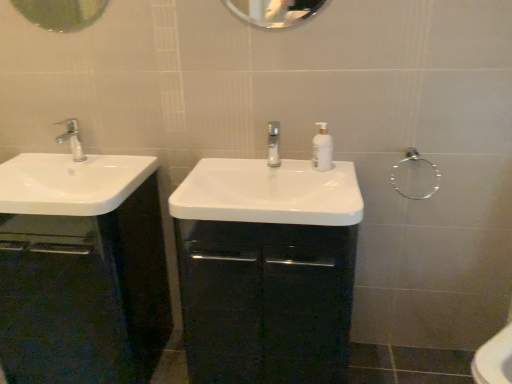
Locate an element on the screen. metallic circular mirror at upper left, which is the second mirror from right to left is located at coordinates (61, 13).

What do you see at coordinates (72, 139) in the screenshot? I see `silver metallic faucet at left, the second tap when ordered from right to left` at bounding box center [72, 139].

The image size is (512, 384). What do you see at coordinates (70, 180) in the screenshot?
I see `white glossy sink at left, the second sink in the right-to-left sequence` at bounding box center [70, 180].

Measure the distance between clear glass towel ring at upper right and camera.

clear glass towel ring at upper right and camera are 5.14 feet apart from each other.

Identify the location of metallic circular mirror at upper left, which is counted as the 1th mirror, starting from the left. This screenshot has width=512, height=384. (61, 13).

Considering the positions of objects glossy black cabinet at center, which is the 2th bathroom cabinet in left-to-right order, and clear glass mirror at upper center, the second mirror viewed from the left, in the image provided, who is more to the left, glossy black cabinet at center, which is the 2th bathroom cabinet in left-to-right order, or clear glass mirror at upper center, the second mirror viewed from the left,?

From the viewer's perspective, glossy black cabinet at center, which is the 2th bathroom cabinet in left-to-right order, appears more on the left side.

Between glossy black cabinet at center, arranged as the 1th bathroom cabinet when viewed from the right, and clear glass mirror at upper center, the first mirror when ordered from right to left, which one has larger size?

glossy black cabinet at center, arranged as the 1th bathroom cabinet when viewed from the right.

From a real-world perspective, is glossy black cabinet at center, arranged as the 1th bathroom cabinet when viewed from the right, located higher than clear glass mirror at upper center, the first mirror when ordered from right to left?

Incorrect, from a real-world perspective, glossy black cabinet at center, arranged as the 1th bathroom cabinet when viewed from the right, is lower than clear glass mirror at upper center, the first mirror when ordered from right to left.

In terms of size, does clear glass tap at center, the 1th tap from the right, appear bigger or smaller than white glossy soap dispenser at center?

Considering their sizes, clear glass tap at center, the 1th tap from the right, takes up more space than white glossy soap dispenser at center.

From a real-world perspective, relative to white glossy soap dispenser at center, is clear glass tap at center, the 2th tap positioned from the left, vertically above or below?

Clearly, from a real-world perspective, clear glass tap at center, the 2th tap positioned from the left, is below white glossy soap dispenser at center.

Where is `tap lying below the white glossy soap dispenser at center (from the image's perspective)`? This screenshot has width=512, height=384. tap lying below the white glossy soap dispenser at center (from the image's perspective) is located at coordinates (273, 144).

Is clear glass towel ring at upper right completely or partially outside of silver metallic faucet at left, the second tap when ordered from right to left?

Yes.

How many degrees apart are the facing directions of clear glass towel ring at upper right and silver metallic faucet at left, the second tap when ordered from right to left?

The angular difference between clear glass towel ring at upper right and silver metallic faucet at left, the second tap when ordered from right to left, is 0.339 degrees.

Is clear glass towel ring at upper right turned away from silver metallic faucet at left, the second tap when ordered from right to left?

That's not correct — clear glass towel ring at upper right is not looking away from silver metallic faucet at left, the second tap when ordered from right to left.

Considering the relative positions of clear glass towel ring at upper right and silver metallic faucet at left, the second tap when ordered from right to left, in the image provided, is clear glass towel ring at upper right to the left or to the right of silver metallic faucet at left, the second tap when ordered from right to left,?

Based on their positions, clear glass towel ring at upper right is located to the right of silver metallic faucet at left, the second tap when ordered from right to left.

Is clear glass mirror at upper center, the second mirror viewed from the left, positioned before glossy black cabinet at center, which is the 2th bathroom cabinet in left-to-right order?

No, it is not.

From the image's perspective, is clear glass mirror at upper center, the second mirror viewed from the left, on glossy black cabinet at center, which is the 2th bathroom cabinet in left-to-right order?

Yes, from the image's perspective, clear glass mirror at upper center, the second mirror viewed from the left, is above glossy black cabinet at center, which is the 2th bathroom cabinet in left-to-right order.

Is clear glass mirror at upper center, the first mirror when ordered from right to left, not within glossy black cabinet at center, arranged as the 1th bathroom cabinet when viewed from the right?

clear glass mirror at upper center, the first mirror when ordered from right to left, is positioned outside glossy black cabinet at center, arranged as the 1th bathroom cabinet when viewed from the right.

Consider the image. Considering the sizes of black glossy cabinet at left, which is counted as the first bathroom cabinet, starting from the left, and silver metallic faucet at left, the 1th tap viewed from the left, in the image, is black glossy cabinet at left, which is counted as the first bathroom cabinet, starting from the left, bigger or smaller than silver metallic faucet at left, the 1th tap viewed from the left,?

In the image, black glossy cabinet at left, which is counted as the first bathroom cabinet, starting from the left, appears to be larger than silver metallic faucet at left, the 1th tap viewed from the left.

From the image's perspective, is black glossy cabinet at left, which is the second bathroom cabinet in right-to-left order, above silver metallic faucet at left, the second tap when ordered from right to left?

No, from the image's perspective, black glossy cabinet at left, which is the second bathroom cabinet in right-to-left order, is not over silver metallic faucet at left, the second tap when ordered from right to left.

From a real-world perspective, who is located lower, black glossy cabinet at left, which is counted as the first bathroom cabinet, starting from the left, or silver metallic faucet at left, the second tap when ordered from right to left?

From a 3D spatial view, black glossy cabinet at left, which is counted as the first bathroom cabinet, starting from the left, is below.

Which object is further away from the camera taking this photo, black glossy cabinet at left, which is the second bathroom cabinet in right-to-left order, or silver metallic faucet at left, the 1th tap viewed from the left?

silver metallic faucet at left, the 1th tap viewed from the left, is behind.

In the image, is silver metallic faucet at left, the 1th tap viewed from the left, on the left side or the right side of clear glass mirror at upper center, the first mirror when ordered from right to left?

From the image, it's evident that silver metallic faucet at left, the 1th tap viewed from the left, is to the left of clear glass mirror at upper center, the first mirror when ordered from right to left.

Which of these two, silver metallic faucet at left, the second tap when ordered from right to left, or clear glass mirror at upper center, the first mirror when ordered from right to left, is wider?

silver metallic faucet at left, the second tap when ordered from right to left, is wider.

From the image's perspective, is silver metallic faucet at left, the 1th tap viewed from the left, above clear glass mirror at upper center, the first mirror when ordered from right to left?

Actually, silver metallic faucet at left, the 1th tap viewed from the left, appears below clear glass mirror at upper center, the first mirror when ordered from right to left, in the image.

Starting from the clear glass mirror at upper center, the second mirror viewed from the left, which tap is the 2nd one to the left? Please provide its 2D coordinates.

[(72, 139)]

Which object is closer to the camera taking this photo, clear glass towel ring at upper right or black glossy cabinet at left, which is counted as the first bathroom cabinet, starting from the left?

black glossy cabinet at left, which is counted as the first bathroom cabinet, starting from the left, is more forward.

Would you say black glossy cabinet at left, which is counted as the first bathroom cabinet, starting from the left, is part of clear glass towel ring at upper right's contents?

No, black glossy cabinet at left, which is counted as the first bathroom cabinet, starting from the left, is not inside clear glass towel ring at upper right.

Considering the points (425, 188) and (121, 378), which point is behind, point (425, 188) or point (121, 378)?

The point (121, 378) is farther.

This screenshot has width=512, height=384. Find the location of `mirror to the right of glossy black cabinet at center, arranged as the 1th bathroom cabinet when viewed from the right`. mirror to the right of glossy black cabinet at center, arranged as the 1th bathroom cabinet when viewed from the right is located at coordinates (274, 11).

You are a GUI agent. You are given a task and a screenshot of the screen. Output one action in this format:
    pyautogui.click(x=<x>, y=<y>)
    Task: Click on the soap dispenser above the clear glass tap at center, the 2th tap positioned from the left (from a real-world perspective)
    This screenshot has width=512, height=384.
    Given the screenshot: What is the action you would take?
    pyautogui.click(x=322, y=149)

Which object lies further to the anchor point white glossy sink at center, which is the 2th sink from left to right, black glossy cabinet at left, which is counted as the first bathroom cabinet, starting from the left, or glossy black cabinet at center, arranged as the 1th bathroom cabinet when viewed from the right?

black glossy cabinet at left, which is counted as the first bathroom cabinet, starting from the left, lies further to white glossy sink at center, which is the 2th sink from left to right, than the other object.

Based on the photo, when comparing their distances from clear glass towel ring at upper right, does white glossy sink at center, arranged as the 1th sink when viewed from the right, or silver metallic faucet at left, the 1th tap viewed from the left, seem closer?

Based on the image, white glossy sink at center, arranged as the 1th sink when viewed from the right, appears to be nearer to clear glass towel ring at upper right.

Estimate the real-world distances between objects in this image. Which object is closer to white glossy sink at center, which is the 2th sink from left to right, white glossy soap dispenser at center or silver metallic faucet at left, the 1th tap viewed from the left?

The object closer to white glossy sink at center, which is the 2th sink from left to right, is white glossy soap dispenser at center.

Which object lies nearer to the anchor point metallic circular mirror at upper left, which is counted as the 1th mirror, starting from the left, clear glass mirror at upper center, the first mirror when ordered from right to left, or clear glass tap at center, the 1th tap from the right?

clear glass mirror at upper center, the first mirror when ordered from right to left.

From the image, which object appears to be farther from white glossy soap dispenser at center, metallic circular mirror at upper left, which is counted as the 1th mirror, starting from the left, or clear glass mirror at upper center, the first mirror when ordered from right to left?

metallic circular mirror at upper left, which is counted as the 1th mirror, starting from the left.

Based on the photo, based on their spatial positions, is silver metallic faucet at left, the second tap when ordered from right to left, or metallic circular mirror at upper left, which is the second mirror from right to left, further from clear glass towel ring at upper right?

metallic circular mirror at upper left, which is the second mirror from right to left, is positioned further to the anchor clear glass towel ring at upper right.

Estimate the real-world distances between objects in this image. Which object is closer to clear glass mirror at upper center, the second mirror viewed from the left, black glossy cabinet at left, which is the second bathroom cabinet in right-to-left order, or white glossy sink at center, arranged as the 1th sink when viewed from the right?

white glossy sink at center, arranged as the 1th sink when viewed from the right, is positioned closer to the anchor clear glass mirror at upper center, the second mirror viewed from the left.

Looking at the image, which one is located further to white glossy sink at left, the second sink in the right-to-left sequence, black glossy cabinet at left, which is the second bathroom cabinet in right-to-left order, or white glossy sink at center, arranged as the 1th sink when viewed from the right?

white glossy sink at center, arranged as the 1th sink when viewed from the right.

You are a GUI agent. You are given a task and a screenshot of the screen. Output one action in this format:
    pyautogui.click(x=<x>, y=<y>)
    Task: Click on the sink between metallic circular mirror at upper left, which is the second mirror from right to left, and clear glass towel ring at upper right from left to right
    
    Given the screenshot: What is the action you would take?
    coord(269,193)

Identify the location of sink between white glossy sink at left, the second sink in the right-to-left sequence, and white glossy soap dispenser at center. (269, 193).

The width and height of the screenshot is (512, 384). I want to click on mirror located between white glossy sink at left, which is the first sink from left to right, and clear glass tap at center, the 2th tap positioned from the left, in the left-right direction, so click(61, 13).

The image size is (512, 384). Find the location of `shower that lies between white glossy soap dispenser at center and glossy black cabinet at center, which is the 2th bathroom cabinet in left-to-right order, from top to bottom`. shower that lies between white glossy soap dispenser at center and glossy black cabinet at center, which is the 2th bathroom cabinet in left-to-right order, from top to bottom is located at coordinates (415, 175).